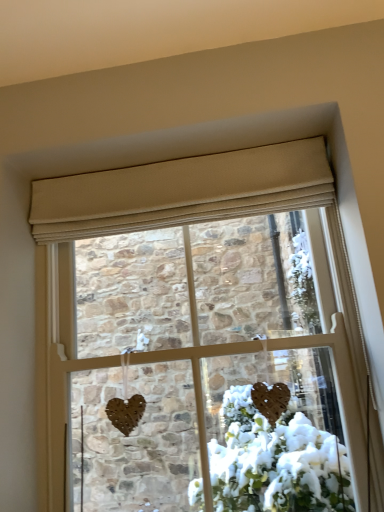
Identify the location of vacant region above matte brown heart at center (from a real-world perspective). The width and height of the screenshot is (384, 512). (172, 223).